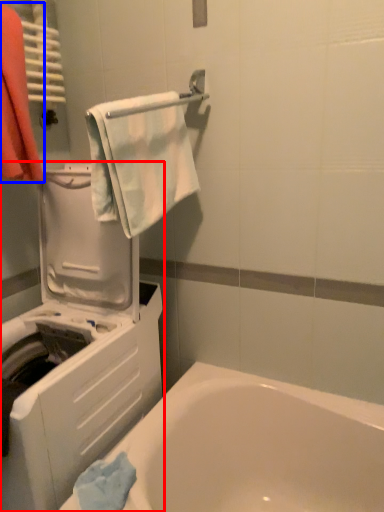
Question: Which object is closer to the camera taking this photo, washing machine (highlighted by a red box) or laundry (highlighted by a blue box)?

Choices:
 (A) washing machine
 (B) laundry

Answer: (A)